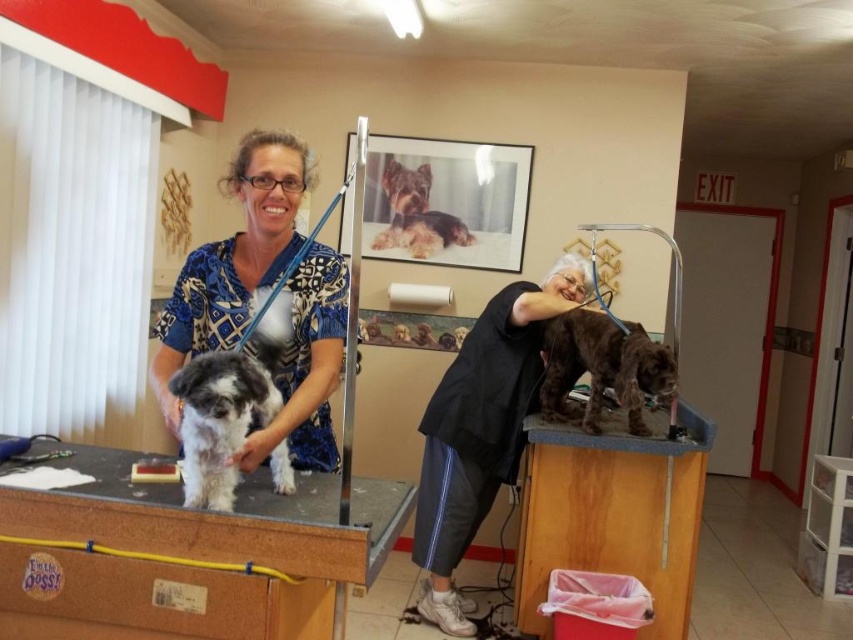
From the picture: You are a new employee at the pet grooming salon and need to place a new grooming tool on the wooden table at center. Based on the coordinates given, where exactly should you place the tool on the table?

The wooden table at center is located at coordinates point (x=219, y=522), so you should place the new grooming tool at that exact position on the table.

You are standing in the pet grooming salon and want to place a small decorative item between the two points labeled point (546, 390) and point (397, 211). Which point should the item be closer to in order to appear closer to the viewer?

The item should be placed closer to point (546, 390) because it is closer to the viewer than point (397, 211).

You are a new employee at the pet grooming salon and need to measure the distance between the two shiny brown fur areas. According to the scene, how far apart are the shiny brown fur at center and the shiny brown fur at upper center?

The shiny brown fur at center and the shiny brown fur at upper center are 4.37 feet apart from each other.